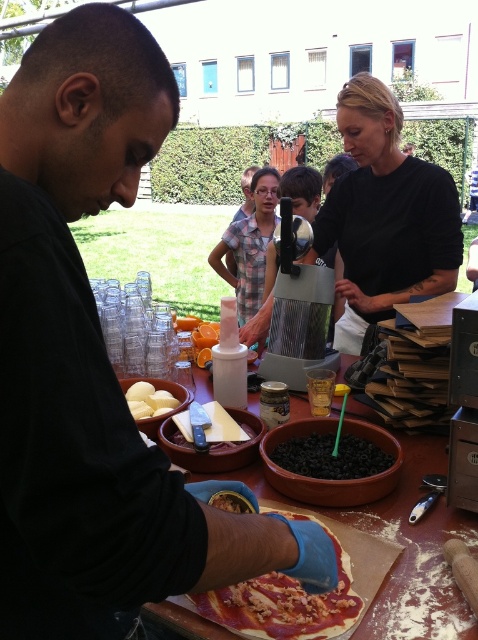
Question: Which object is closer to the camera taking this photo?

Choices:
 (A) sharp metallic knife at center
 (B) blue latex glove at lower center
 (C) white matte potato at center
 (D) thick dough pizza at center

Answer: (B)

Question: Does black matte beans at center appear over sharp metallic knife at center?

Choices:
 (A) no
 (B) yes

Answer: (A)

Question: Estimate the real-world distances between objects in this image. Which object is closer to the thick dough pizza at center?

Choices:
 (A) brown clay table at center
 (B) sharp metallic knife at center

Answer: (A)

Question: Is black matte beans at center to the right of sharp metallic knife at center from the viewer's perspective?

Choices:
 (A) yes
 (B) no

Answer: (A)

Question: Which of these objects is positioned closest to the thick dough pizza at center?

Choices:
 (A) sharp metallic knife at center
 (B) blue latex glove at lower center
 (C) white matte potato at center
 (D) brown clay table at center

Answer: (D)

Question: Does blue latex glove at lower center have a larger size compared to black matte shirt at upper center?

Choices:
 (A) no
 (B) yes

Answer: (A)